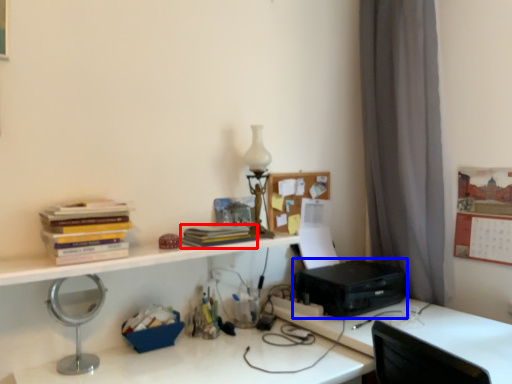
Question: Which of the following is the closest to the observer, paperback book (highlighted by a red box) or printer (highlighted by a blue box)?

Choices:
 (A) paperback book
 (B) printer

Answer: (A)